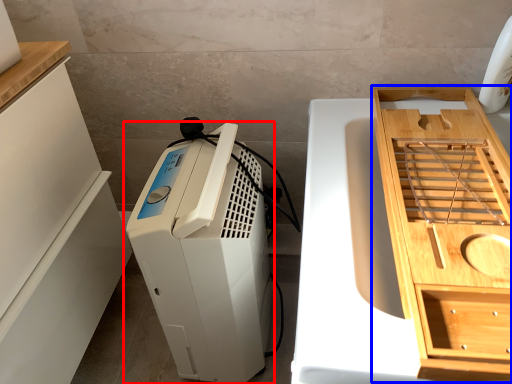
Question: Which of the following is the farthest to the observer, home appliance (highlighted by a red box) or cabinetry (highlighted by a blue box)?

Choices:
 (A) home appliance
 (B) cabinetry

Answer: (A)